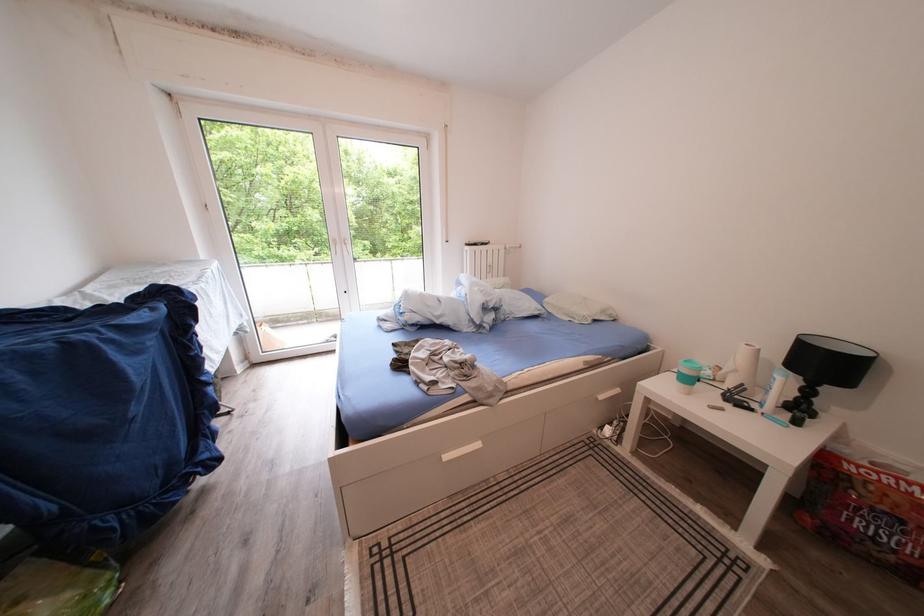
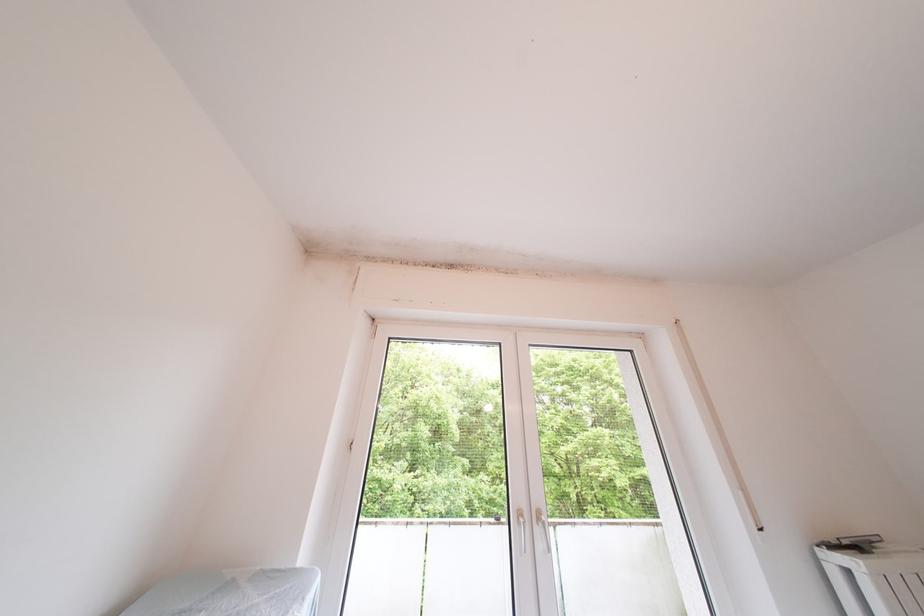
Locate, in the second image, the point that corresponds to point (354, 257) in the first image.

(550, 552)